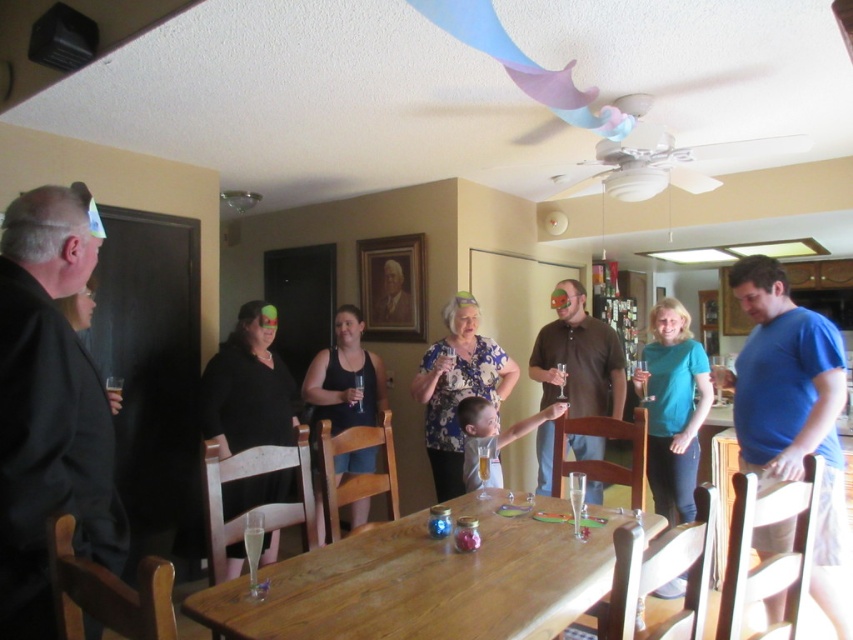
Based on the photo, can you confirm if blue cotton t-shirt at right is positioned to the left of black tank top at center?

Incorrect, blue cotton t-shirt at right is not on the left side of black tank top at center.

Who is higher up, blue cotton t-shirt at right or black tank top at center?

blue cotton t-shirt at right is higher up.

Which is in front, point (848, 544) or point (383, 396)?

Point (848, 544) is more forward.

The width and height of the screenshot is (853, 640). Find the location of `blue cotton t-shirt at right`. blue cotton t-shirt at right is located at coordinates (793, 413).

Can you confirm if black matte mask at left is bigger than brown cotton shirt at center?

Incorrect, black matte mask at left is not larger than brown cotton shirt at center.

Is black matte mask at left above brown cotton shirt at center?

No, black matte mask at left is not above brown cotton shirt at center.

Where is `black matte mask at left`? The height and width of the screenshot is (640, 853). black matte mask at left is located at coordinates (248, 387).

Does wooden table at center have a larger size compared to black tank top at center?

Actually, wooden table at center might be smaller than black tank top at center.

Does wooden table at center appear on the left side of black tank top at center?

Incorrect, wooden table at center is not on the left side of black tank top at center.

This screenshot has width=853, height=640. Identify the location of wooden table at center. (424, 582).

Where is `wooden table at center`? Image resolution: width=853 pixels, height=640 pixels. wooden table at center is located at coordinates (424, 582).